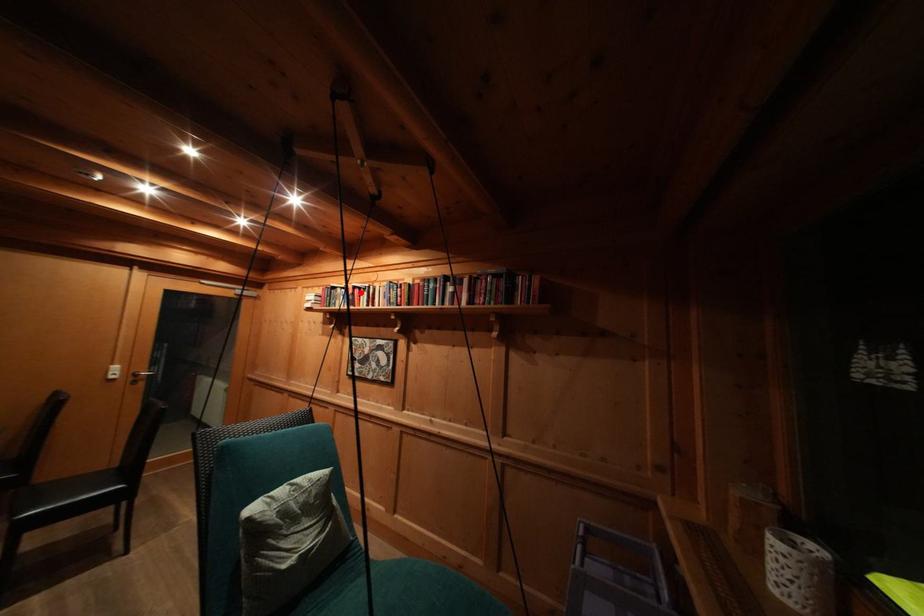
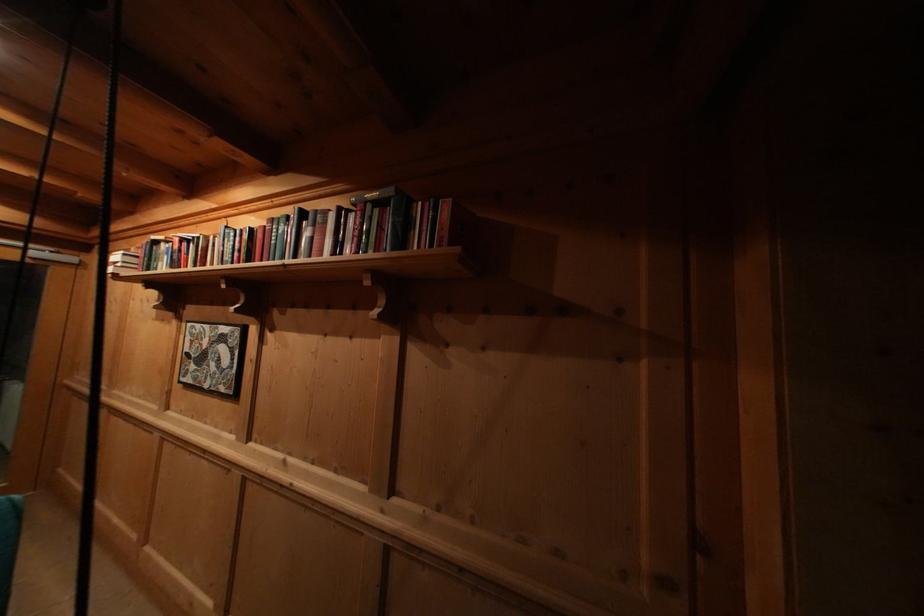
Find the pixel in the second image that matches the highlighted location in the first image.

(188, 246)